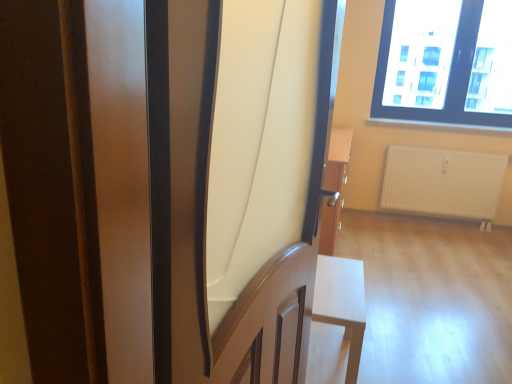
Identify the location of blank space above white matte radiator at lower right (from a real-world perspective). This screenshot has width=512, height=384. (463, 147).